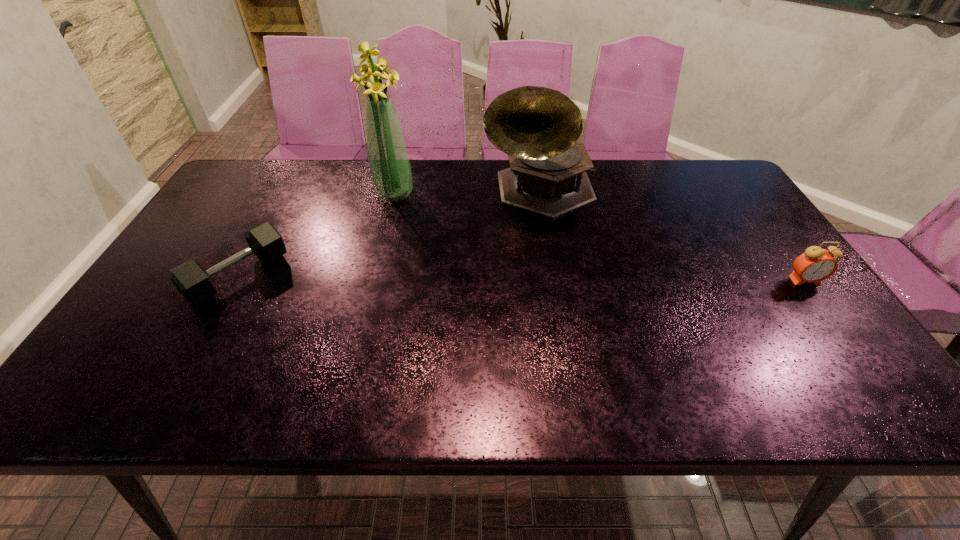
The width and height of the screenshot is (960, 540). Identify the location of free spot at the far edge of the desktop. (363, 198).

The image size is (960, 540). What are the coordinates of `vacant region at the near edge of the desktop` in the screenshot? It's located at (565, 357).

At what (x,y) coordinates should I click in order to perform the action: click on vacant region at the left edge of the desktop. Please return your answer as a coordinate pair (x, y). This screenshot has height=540, width=960. Looking at the image, I should click on (212, 210).

Locate an element on the screen. This screenshot has width=960, height=540. vacant space at the right edge is located at coordinates (717, 209).

The width and height of the screenshot is (960, 540). In the image, there is a desktop. Find the location of `vacant space at the far right corner`. vacant space at the far right corner is located at coordinates (721, 167).

Identify the location of empty space that is in between the dumbbell and the phonograph record. Image resolution: width=960 pixels, height=540 pixels. (389, 233).

The image size is (960, 540). Identify the location of vacant region between the alarm clock and the phonograph record. (672, 236).

Find the location of a particular element. The width and height of the screenshot is (960, 540). vacant area between the second object from left to right and the alarm clock is located at coordinates (599, 238).

Where is `free space between the second object from right to left and the third tallest object`? The height and width of the screenshot is (540, 960). free space between the second object from right to left and the third tallest object is located at coordinates (672, 236).

Identify the location of empty location between the tallest object and the dumbbell. This screenshot has width=960, height=540. (316, 235).